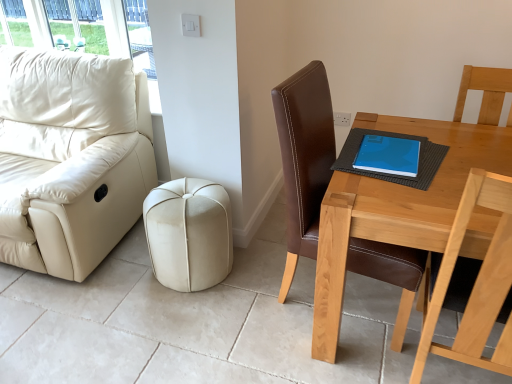
Locate an element on the screen. The image size is (512, 384). free space to the left of brown leather chair at right is located at coordinates (253, 317).